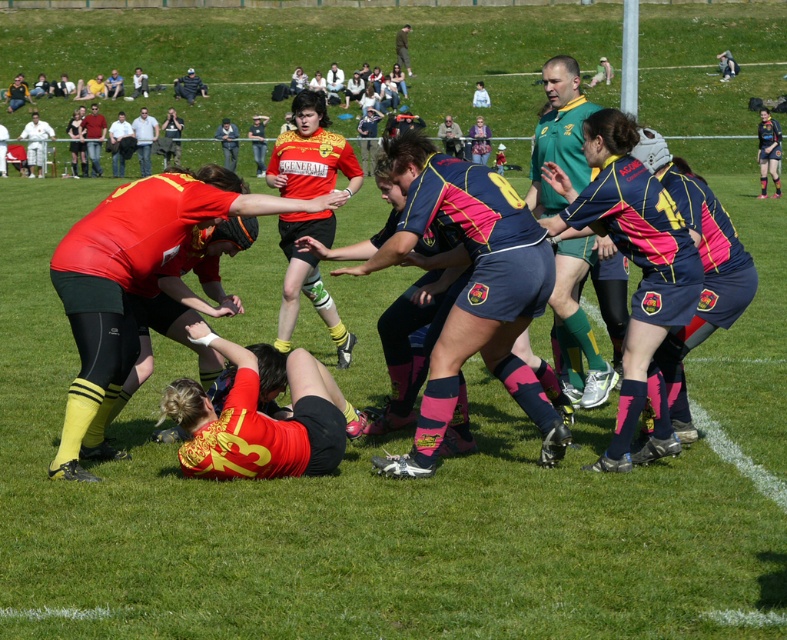
Question: Is matte yellow jersey at center to the left of green jersey at upper center from the viewer's perspective?

Choices:
 (A) yes
 (B) no

Answer: (A)

Question: Which is farther from the green jersey at upper center?

Choices:
 (A) matte yellow jersey at center
 (B) matte black shorts at upper right

Answer: (B)

Question: Does matte yellow jersey at center have a greater width compared to green jersey at upper center?

Choices:
 (A) yes
 (B) no

Answer: (A)

Question: Which object appears farthest from the camera in this image?

Choices:
 (A) green jersey at upper center
 (B) matte yellow jersey at center
 (C) matte black shorts at upper right

Answer: (C)

Question: Can you confirm if green jersey at upper center is positioned to the left of matte black shorts at upper right?

Choices:
 (A) no
 (B) yes

Answer: (B)

Question: Estimate the real-world distances between objects in this image. Which object is farther from the matte yellow jersey at center?

Choices:
 (A) green jersey at upper center
 (B) matte black shorts at upper right

Answer: (B)